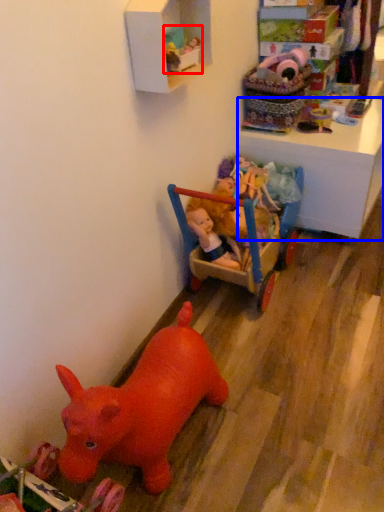
Question: Among these objects, which one is farthest to the camera, toy (highlighted by a red box) or changing table (highlighted by a blue box)?

Choices:
 (A) toy
 (B) changing table

Answer: (B)